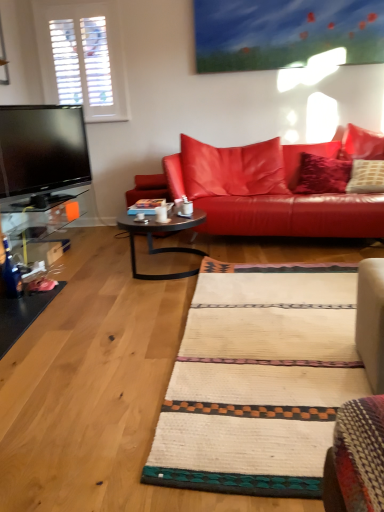
I want to click on vacant space behind white glossy mug at center, so click(163, 214).